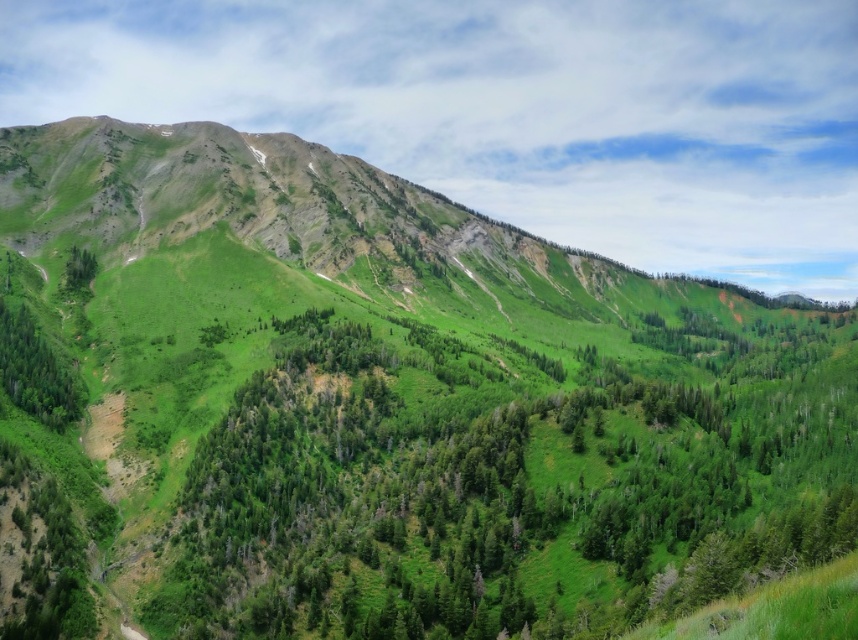
Question: Which point is closer to the camera taking this photo?

Choices:
 (A) (25, 355)
 (B) (539, 520)
 (C) (88, 272)

Answer: (B)

Question: Estimate the real-world distances between objects in this image. Which object is farther from the green leafy tree at upper left?

Choices:
 (A) green leafy tree at lower left
 (B) green leafy trees at center

Answer: (B)

Question: Which point is closer to the camera taking this photo?

Choices:
 (A) (479, 634)
 (B) (56, 392)

Answer: (A)

Question: Is green leafy trees at center bigger than green leafy tree at upper left?

Choices:
 (A) yes
 (B) no

Answer: (A)

Question: Is green leafy tree at lower left further to the viewer compared to green leafy tree at upper left?

Choices:
 (A) yes
 (B) no

Answer: (B)

Question: Can you confirm if green leafy tree at lower left is thinner than green leafy tree at upper left?

Choices:
 (A) yes
 (B) no

Answer: (B)